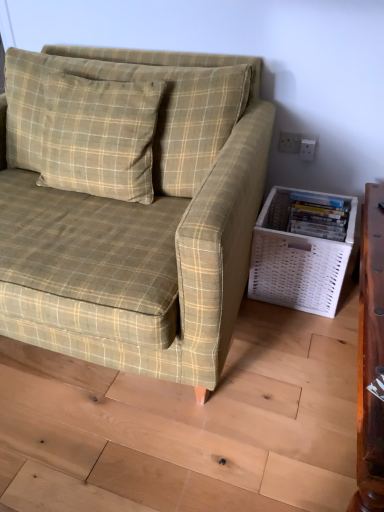
This screenshot has width=384, height=512. What are the coordinates of `white woven basket at lower right` in the screenshot? It's located at (297, 259).

Is green plaid fabric couch at center at the back of white woven basket at lower right?

No, white woven basket at lower right's orientation is not away from green plaid fabric couch at center.

Is white woven basket at lower right taller than green plaid fabric couch at center?

In fact, white woven basket at lower right may be shorter than green plaid fabric couch at center.

Would you say white woven basket at lower right is inside or outside green plaid fabric couch at center?

white woven basket at lower right cannot be found inside green plaid fabric couch at center.

Considering the sizes of objects green plaid pillow at upper left and white plastic electric outlet at upper right in the image provided, who is taller, green plaid pillow at upper left or white plastic electric outlet at upper right?

green plaid pillow at upper left is taller.

You are a GUI agent. You are given a task and a screenshot of the screen. Output one action in this format:
    pyautogui.click(x=<x>, y=<y>)
    Task: Click on the electric outlet on the right of green plaid pillow at upper left
    The image size is (384, 512).
    Given the screenshot: What is the action you would take?
    pyautogui.click(x=298, y=144)

Which is more to the left, green plaid pillow at upper left or white plastic electric outlet at upper right?

Positioned to the left is green plaid pillow at upper left.

Would you say green plaid pillow at upper left is inside or outside white plastic electric outlet at upper right?

green plaid pillow at upper left is not inside white plastic electric outlet at upper right, it's outside.

Is white plastic electric outlet at upper right spatially inside white woven basket at lower right, or outside of it?

white plastic electric outlet at upper right is not enclosed by white woven basket at lower right.

Based on their sizes in the image, would you say white plastic electric outlet at upper right is bigger or smaller than white woven basket at lower right?

Considering their sizes, white plastic electric outlet at upper right takes up less space than white woven basket at lower right.

Is white plastic electric outlet at upper right placed right next to white woven basket at lower right?

white plastic electric outlet at upper right is not next to white woven basket at lower right, and they're not touching.

Can you confirm if white plastic electric outlet at upper right is shorter than white woven basket at lower right?

Yes.

How far apart are green plaid fabric couch at center and white woven basket at lower right?

They are 21.25 inches apart.

Where is `studio couch in front of the white woven basket at lower right`? This screenshot has height=512, width=384. studio couch in front of the white woven basket at lower right is located at coordinates (130, 205).

Is green plaid fabric couch at center facing towards white woven basket at lower right?

No, green plaid fabric couch at center is not facing towards white woven basket at lower right.

Looking at the image, does green plaid fabric couch at center seem bigger or smaller compared to white woven basket at lower right?

green plaid fabric couch at center is bigger than white woven basket at lower right.

Is white plastic electric outlet at upper right at the back of green plaid fabric couch at center?

That's not correct — green plaid fabric couch at center is not looking away from white plastic electric outlet at upper right.

Between green plaid fabric couch at center and white plastic electric outlet at upper right, which one has smaller size?

white plastic electric outlet at upper right.

Is green plaid fabric couch at center taller than white plastic electric outlet at upper right?

Correct, green plaid fabric couch at center is much taller as white plastic electric outlet at upper right.

Is green plaid fabric couch at center positioned before white plastic electric outlet at upper right?

Yes, it is.

Is green plaid pillow at upper left with green plaid fabric couch at center?

No, green plaid pillow at upper left is not with green plaid fabric couch at center.

Is green plaid pillow at upper left positioned with its back to green plaid fabric couch at center?

Yes.

From the image's perspective, is green plaid pillow at upper left located beneath green plaid fabric couch at center?

No, from the image's perspective, green plaid pillow at upper left is not beneath green plaid fabric couch at center.

From a real-world perspective, who is located lower, green plaid pillow at upper left or green plaid fabric couch at center?

green plaid fabric couch at center, from a real-world perspective.

Considering the sizes of green plaid pillow at upper left and white woven basket at lower right in the image, is green plaid pillow at upper left taller or shorter than white woven basket at lower right?

Clearly, green plaid pillow at upper left is taller compared to white woven basket at lower right.

Is point (146, 152) positioned after point (337, 252)?

No, it is not.

What's the angular difference between green plaid pillow at upper left and white woven basket at lower right's facing directions?

6.1 degrees.

Is green plaid pillow at upper left directly adjacent to white woven basket at lower right?

No.

Identify the location of studio couch lying above the white woven basket at lower right (from the image's perspective). This screenshot has width=384, height=512. (130, 205).

Identify the location of electric outlet below the green plaid pillow at upper left (from a real-world perspective). (298, 144).

Based on their spatial positions, is white plastic electric outlet at upper right or green plaid pillow at upper left further from green plaid fabric couch at center?

white plastic electric outlet at upper right.

When comparing their distances from white woven basket at lower right, does white plastic electric outlet at upper right or green plaid pillow at upper left seem further?

green plaid pillow at upper left is positioned further to the anchor white woven basket at lower right.

Based on their spatial positions, is white woven basket at lower right or green plaid pillow at upper left closer to white plastic electric outlet at upper right?

white woven basket at lower right is positioned closer to the anchor white plastic electric outlet at upper right.

From the image, which object appears to be nearer to green plaid fabric couch at center, white woven basket at lower right or green plaid pillow at upper left?

Based on the image, green plaid pillow at upper left appears to be nearer to green plaid fabric couch at center.

From the picture: From the image, which object appears to be nearer to white plastic electric outlet at upper right, green plaid pillow at upper left or white woven basket at lower right?

Based on the image, white woven basket at lower right appears to be nearer to white plastic electric outlet at upper right.

Based on their spatial positions, is green plaid pillow at upper left or white plastic electric outlet at upper right closer to green plaid fabric couch at center?

Among the two, green plaid pillow at upper left is located nearer to green plaid fabric couch at center.

Based on their spatial positions, is white plastic electric outlet at upper right or white woven basket at lower right closer to green plaid pillow at upper left?

Among the two, white woven basket at lower right is located nearer to green plaid pillow at upper left.

Considering their positions, is white woven basket at lower right positioned closer to green plaid fabric couch at center than white plastic electric outlet at upper right?

white woven basket at lower right is positioned closer to the anchor green plaid fabric couch at center.

The height and width of the screenshot is (512, 384). What are the coordinates of `pillow between green plaid fabric couch at center and white woven basket at lower right in the horizontal direction` in the screenshot? It's located at (80, 128).

This screenshot has width=384, height=512. I want to click on basket between green plaid fabric couch at center and white plastic electric outlet at upper right in the front-back direction, so click(297, 259).

This screenshot has width=384, height=512. Identify the location of basket situated between green plaid pillow at upper left and white plastic electric outlet at upper right from left to right. (297, 259).

The image size is (384, 512). I want to click on pillow between green plaid fabric couch at center and white plastic electric outlet at upper right in the front-back direction, so click(80, 128).